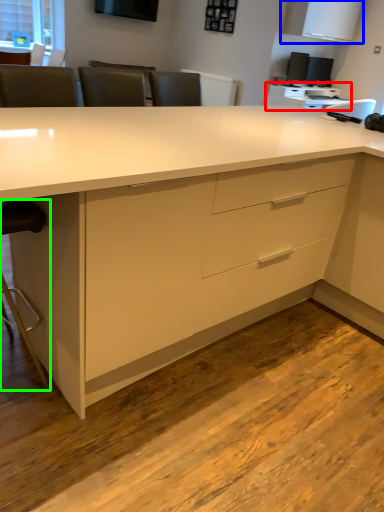
Question: Considering the real-world distances, which object is closest to computer desk (highlighted by a red box)? cabinetry (highlighted by a blue box) or swivel chair (highlighted by a green box).

Choices:
 (A) cabinetry
 (B) swivel chair

Answer: (A)